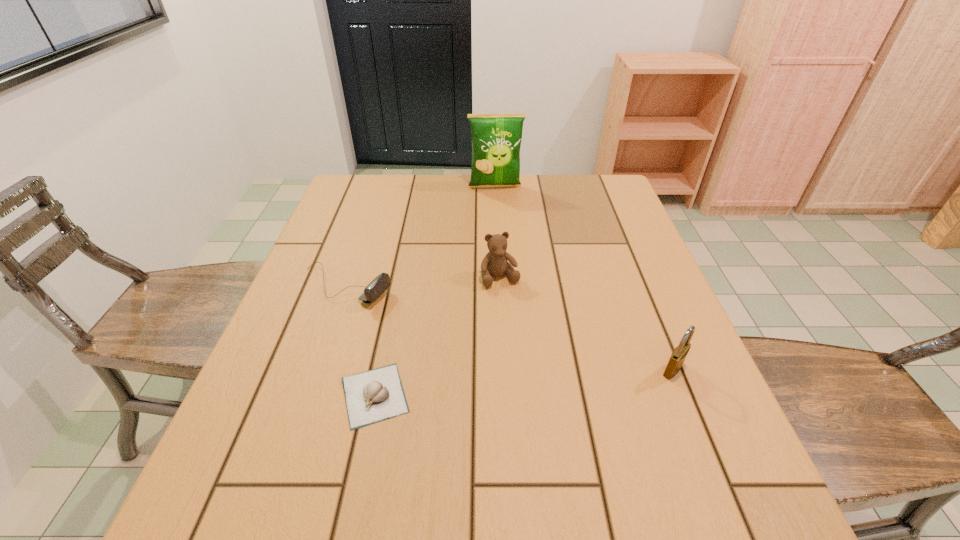
Where is `object that is positioned at the right edge`? object that is positioned at the right edge is located at coordinates (678, 356).

The image size is (960, 540). What are the coordinates of `blank space at the far edge of the desktop` in the screenshot? It's located at (417, 189).

This screenshot has width=960, height=540. In order to click on vacant area at the near edge of the desktop in this screenshot , I will do `click(518, 460)`.

What are the coordinates of `free space at the left edge of the desktop` in the screenshot? It's located at (329, 238).

You are a GUI agent. You are given a task and a screenshot of the screen. Output one action in this format:
    pyautogui.click(x=<x>, y=<y>)
    Task: Click on the free space at the right edge of the desktop
    The height and width of the screenshot is (540, 960).
    Given the screenshot: What is the action you would take?
    pyautogui.click(x=590, y=221)

Where is `free space at the far left corner of the desktop`? This screenshot has height=540, width=960. free space at the far left corner of the desktop is located at coordinates (367, 182).

In the image, there is a desktop. At what (x,y) coordinates should I click in order to perform the action: click on blank space at the far right corner. Please return your answer as a coordinate pair (x, y). The height and width of the screenshot is (540, 960). Looking at the image, I should click on (597, 187).

This screenshot has height=540, width=960. Identify the location of free spot between the webcam and the farthest object. (420, 237).

This screenshot has height=540, width=960. Find the location of `free space between the teddy bear and the rightmost object`. free space between the teddy bear and the rightmost object is located at coordinates (587, 323).

The width and height of the screenshot is (960, 540). I want to click on vacant point located between the second shortest object and the crisp (potato chip), so click(x=420, y=237).